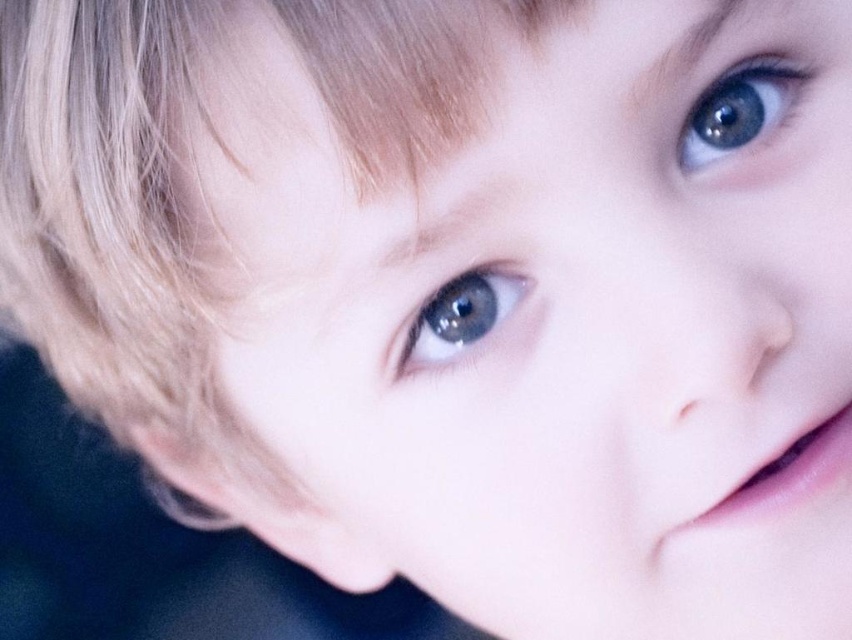
Question: Among these points, which one is farthest from the camera?

Choices:
 (A) click(x=487, y=323)
 (B) click(x=720, y=132)

Answer: (B)

Question: Which point is closer to the camera?

Choices:
 (A) (416, 339)
 (B) (747, 132)

Answer: (A)

Question: Which of the following is the farthest from the observer?

Choices:
 (A) (684, 154)
 (B) (459, 294)

Answer: (A)

Question: Is blue glossy eye at upper center wider than blue glossy eye at center?

Choices:
 (A) yes
 (B) no

Answer: (A)

Question: Does blue glossy eye at upper center have a greater width compared to blue glossy eye at center?

Choices:
 (A) yes
 (B) no

Answer: (A)

Question: Does blue glossy eye at upper center appear under blue glossy eye at center?

Choices:
 (A) no
 (B) yes

Answer: (A)